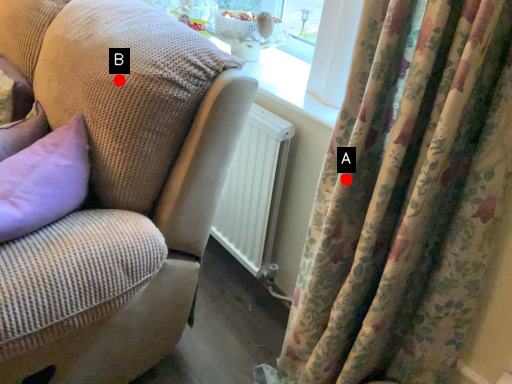
Question: Two points are circled on the image, labeled by A and B beside each circle. Which point is closer to the camera taking this photo?

Choices:
 (A) A is closer
 (B) B is closer

Answer: (A)